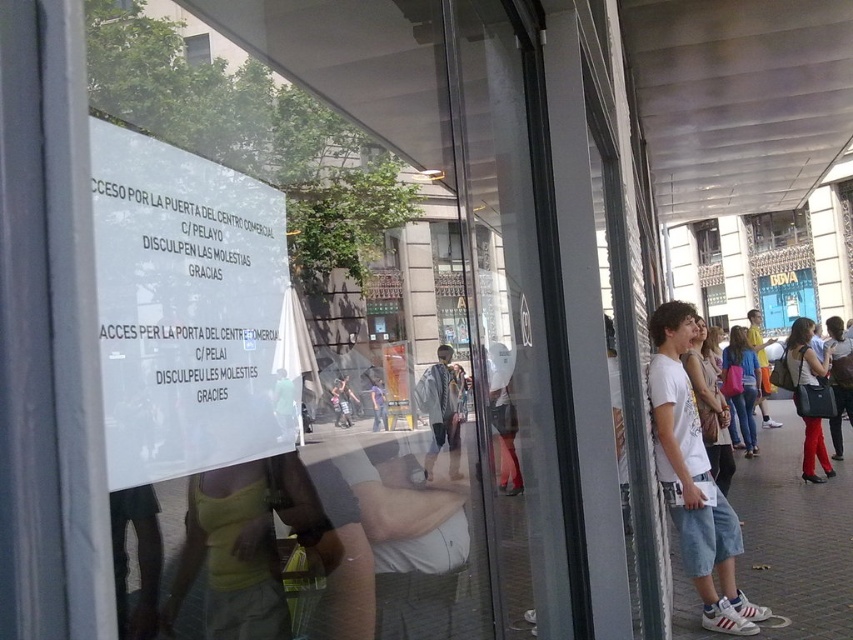
Question: Can you confirm if white cotton shirt at right is wider than clear glass window at upper center?

Choices:
 (A) yes
 (B) no

Answer: (B)

Question: Which of the following is the closest to the observer?

Choices:
 (A) (756, 369)
 (B) (708, 493)

Answer: (B)

Question: Does white cotton t-shirt at center appear on the left side of white cotton shirt at right?

Choices:
 (A) no
 (B) yes

Answer: (B)

Question: Considering the real-world distances, which object is closest to the brown brick pavement at lower right?

Choices:
 (A) matte pink bag at center
 (B) white cotton shirt at right
 (C) clear glass window at center
 (D) matte black bag at right

Answer: (D)

Question: Which object appears farthest from the camera in this image?

Choices:
 (A) matte pink bag at center
 (B) brown brick pavement at lower right
 (C) clear glass window at upper center
 (D) clear glass window at center

Answer: (D)

Question: Does white cotton t-shirt at center have a greater width compared to clear glass window at upper center?

Choices:
 (A) no
 (B) yes

Answer: (A)